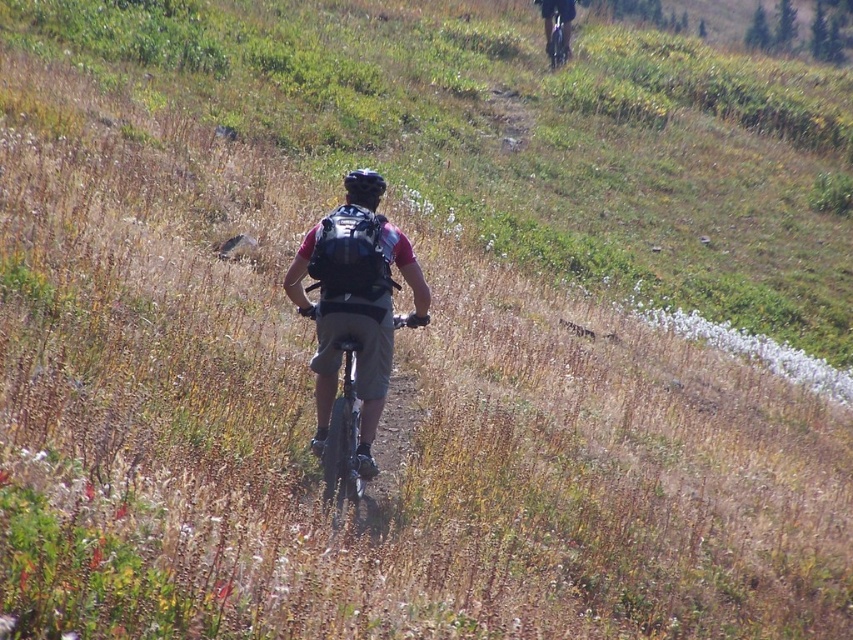
Question: Where is matte black backpack at center located in relation to matte black helmet at center in the image?

Choices:
 (A) left
 (B) right

Answer: (B)

Question: Which object appears farthest from the camera in this image?

Choices:
 (A) matte black backpack at center
 (B) matte black helmet at center

Answer: (B)

Question: Which object is farther from the camera taking this photo?

Choices:
 (A) metallic silver bicycle at center
 (B) matte black backpack at upper center
 (C) matte black backpack at center
 (D) matte black helmet at center

Answer: (B)

Question: Can you confirm if matte black backpack at center is smaller than matte black helmet at center?

Choices:
 (A) no
 (B) yes

Answer: (B)

Question: Does matte black backpack at center have a larger size compared to matte black backpack at upper center?

Choices:
 (A) no
 (B) yes

Answer: (A)

Question: Among these points, which one is farthest from the camera?

Choices:
 (A) (384, 324)
 (B) (552, 32)
 (C) (312, 285)
 (D) (368, 193)

Answer: (B)